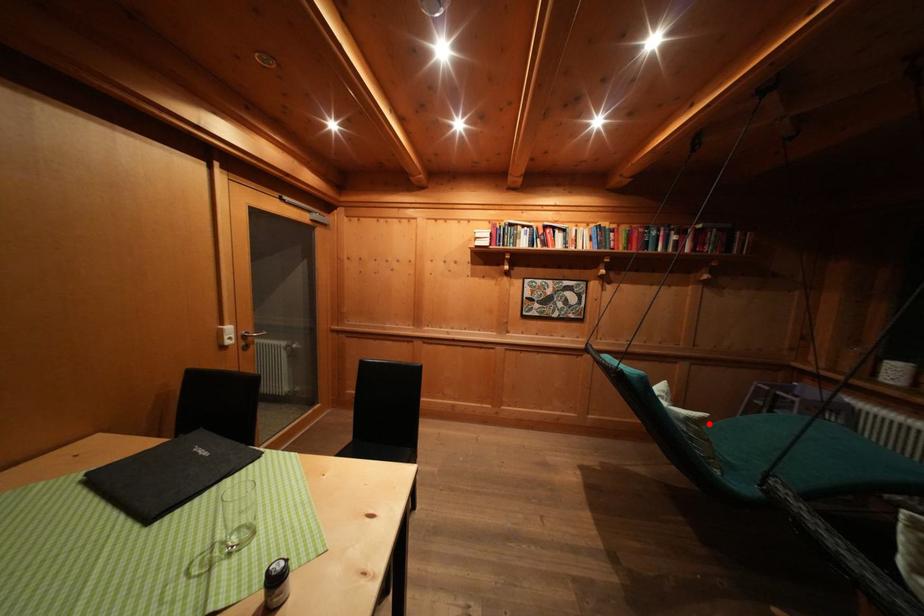
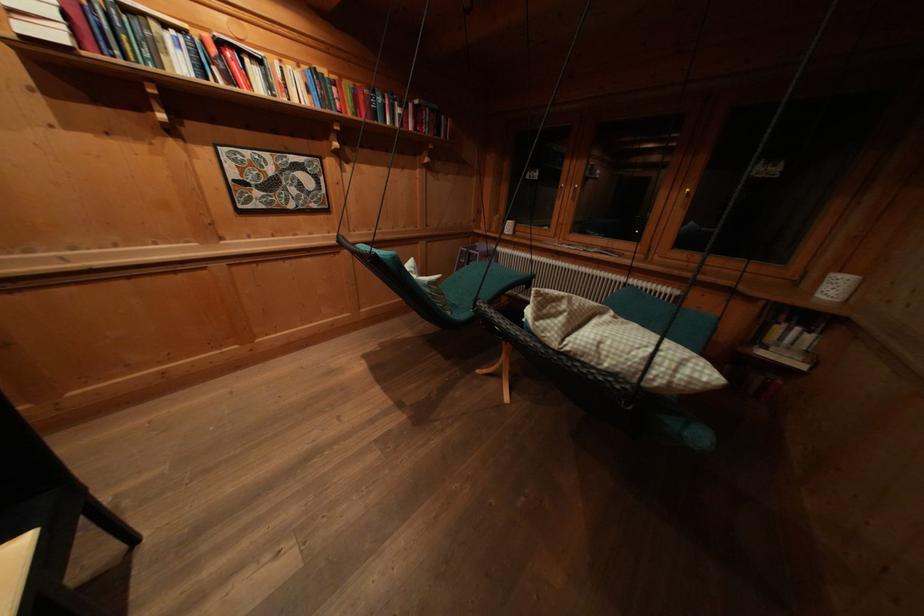
Question: I am providing you with two images of the same scene from different viewpoints. Image1 has a red point marked. In image2, the corresponding 3D location appears at what relative position? Reply with the corresponding letter.

Choices:
 (A) Closer
 (B) Farther

Answer: (A)